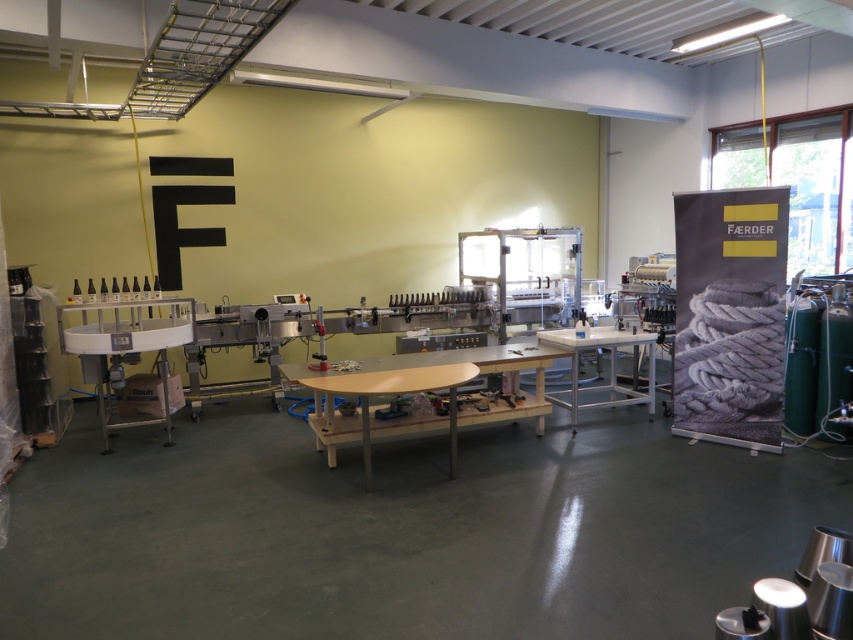
You are a quality control inspector standing at the camera position. You need to check the bottles on the light brown wooden table at center. Can you comfortably reach the table from your position without moving? Explain your reasoning.

The light brown wooden table at center and camera are 12.17 feet apart. Since 12.17 feet is approximately 3.7 meters, which is a considerable distance, you would not be able to comfortably reach the table without moving closer.

You are an employee in this workspace and need to place a heavy box on the floor. You see the metallic gray table at left and the metallic silver table at center. Which table should you avoid placing the box on to prevent it from falling off?

You should avoid placing the box on the metallic gray table at left because it is above the metallic silver table at center, meaning it is elevated and the box might fall off.

You are a worker in the manufacturing facility and need to place a tool on the metallic gray table at left. Where exactly should you place it?

You should place the tool at point (125, 349) on the metallic gray table at left.